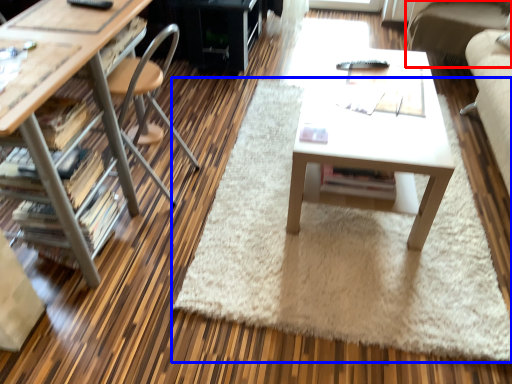
Question: Which object appears farthest to the camera in this image, couch (highlighted by a red box) or mat (highlighted by a blue box)?

Choices:
 (A) couch
 (B) mat

Answer: (A)